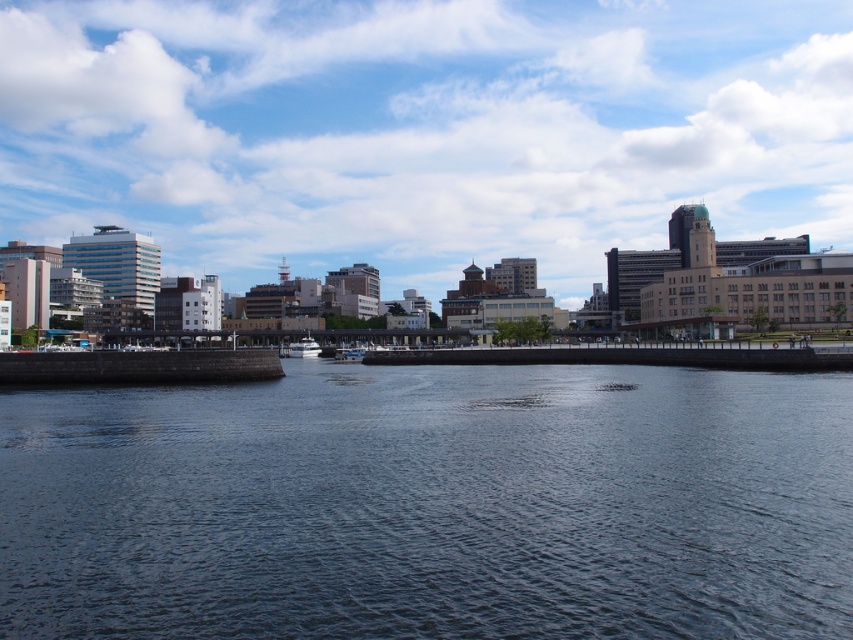
Question: Which of these objects is positioned closest to the white glossy boat at center?

Choices:
 (A) blue sky at upper center
 (B) dark gray water at center

Answer: (B)

Question: Is blue sky at upper center wider than white glossy boat at center?

Choices:
 (A) yes
 (B) no

Answer: (A)

Question: Which point is farther from the camera taking this photo?

Choices:
 (A) (294, 522)
 (B) (254, 116)
 (C) (289, 353)

Answer: (B)

Question: Can you confirm if blue sky at upper center is wider than white glossy boat at center?

Choices:
 (A) yes
 (B) no

Answer: (A)

Question: Which point is farther to the camera?

Choices:
 (A) dark gray water at center
 (B) blue sky at upper center
 (C) white glossy boat at center

Answer: (B)

Question: Is dark gray water at center below blue sky at upper center?

Choices:
 (A) no
 (B) yes

Answer: (B)